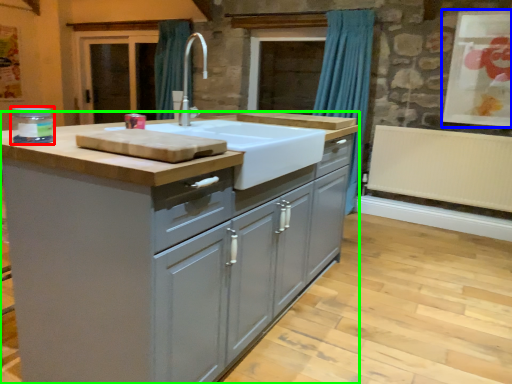
Question: Considering the real-world distances, which object is closest to appliance (highlighted by a red box)? window screen (highlighted by a blue box) or cabinetry (highlighted by a green box).

Choices:
 (A) window screen
 (B) cabinetry

Answer: (B)